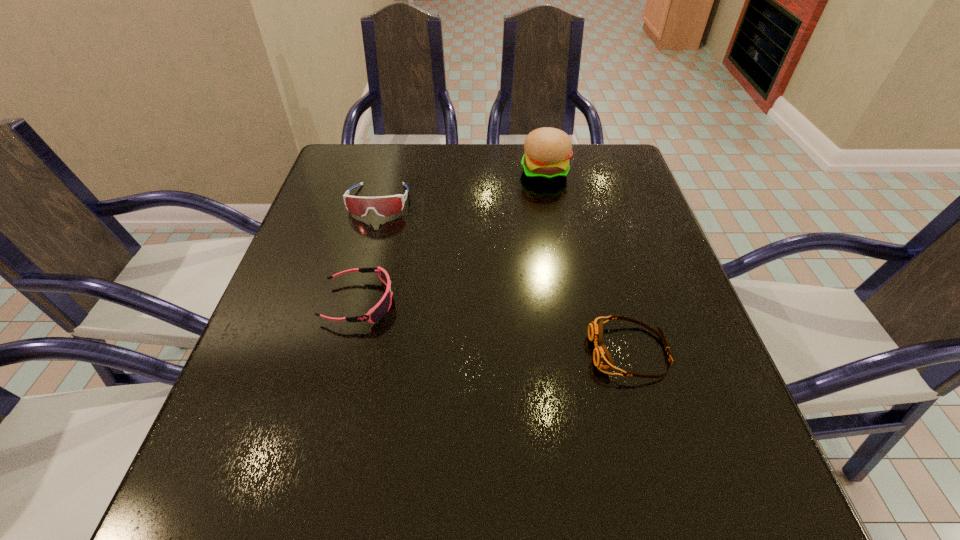
Image resolution: width=960 pixels, height=540 pixels. Identify the location of vacant point located between the tallest goggles and the tallest object. (462, 187).

Locate an element on the screen. vacant area between the second tallest object and the hamburger is located at coordinates (462, 187).

Image resolution: width=960 pixels, height=540 pixels. Identify the location of free spot between the tallest object and the tallest goggles. (462, 187).

Locate an element on the screen. This screenshot has height=540, width=960. unoccupied position between the farthest goggles and the tallest object is located at coordinates (462, 187).

Identify the location of vacant point located between the farthest goggles and the rightmost goggles. Image resolution: width=960 pixels, height=540 pixels. (504, 276).

I want to click on vacant space that's between the hamburger and the tallest goggles, so click(462, 187).

Where is `vacant area that lies between the rightmost goggles and the second tallest object`? vacant area that lies between the rightmost goggles and the second tallest object is located at coordinates (504, 276).

The image size is (960, 540). What are the coordinates of `object that can be found as the closest to the tallest object` in the screenshot? It's located at (384, 206).

Identify which object is located as the second nearest to the farthest goggles. Please provide its 2D coordinates. Your answer should be formatted as a tuple, i.e. [(x, y)], where the tuple contains the x and y coordinates of a point satisfying the conditions above.

[(547, 150)]

This screenshot has height=540, width=960. What are the coordinates of `goggles object that ranks as the second closest to the tallest object` in the screenshot? It's located at (382, 307).